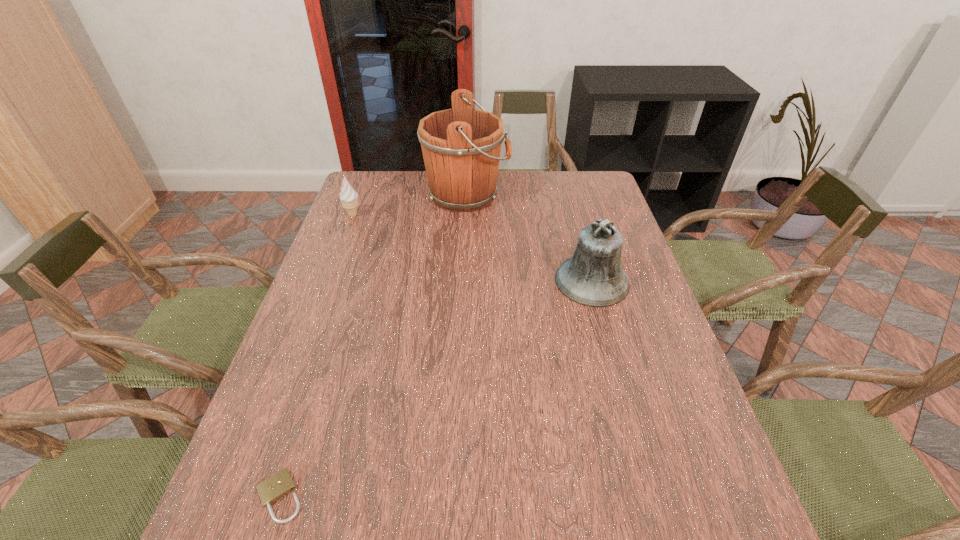
At what (x,y) coordinates should I click in order to perform the action: click on bucket. Please return your answer as a coordinate pair (x, y). This screenshot has height=540, width=960. Looking at the image, I should click on (461, 146).

At what (x,y) coordinates should I click in order to perform the action: click on the second object from right to left. Please return your answer as a coordinate pair (x, y). This screenshot has width=960, height=540. Looking at the image, I should click on (461, 146).

What are the coordinates of `bell` in the screenshot? It's located at (593, 276).

The image size is (960, 540). I want to click on the third farthest object, so click(593, 276).

I want to click on the third tallest object, so click(349, 197).

Find the location of a particular element. The image size is (960, 540). the shortest object is located at coordinates (280, 484).

Where is `the nearest object`? The image size is (960, 540). the nearest object is located at coordinates (280, 484).

Find the location of a particular element. free spot located with the handle on the side of the tallest object is located at coordinates (552, 195).

Where is `free space located 0.100m on the back of the third shortest object`? The width and height of the screenshot is (960, 540). free space located 0.100m on the back of the third shortest object is located at coordinates (580, 238).

You are a GUI agent. You are given a task and a screenshot of the screen. Output one action in this format:
    pyautogui.click(x=<x>, y=<y>)
    Task: Click on the free space located on the front-facing side of the icecream
    This screenshot has height=540, width=960.
    Given the screenshot: What is the action you would take?
    pyautogui.click(x=454, y=215)